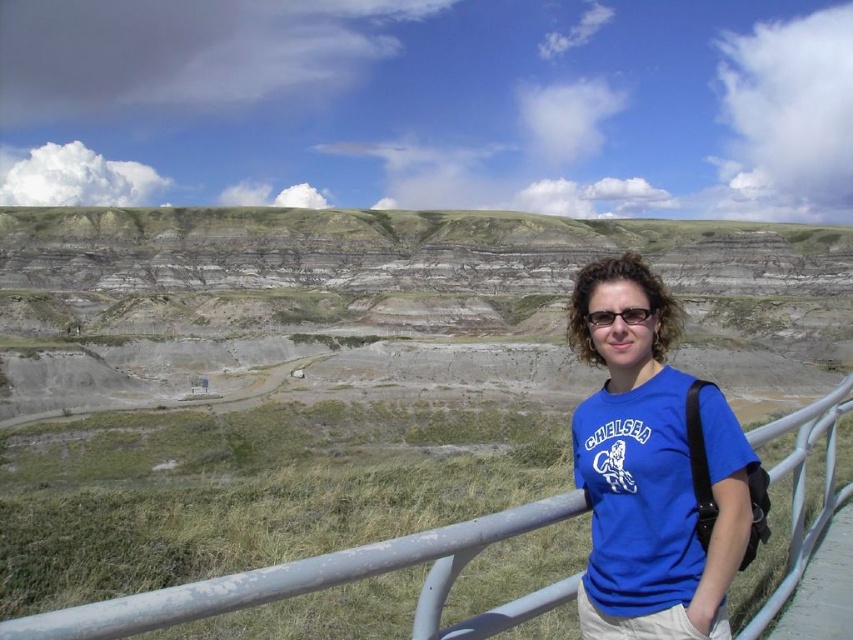
Question: Which point appears farthest from the camera in this image?

Choices:
 (A) (648, 317)
 (B) (612, 500)
 (C) (741, 634)

Answer: (A)

Question: Which point is closer to the camera?

Choices:
 (A) blue cotton shirt at center
 (B) white matte rail at center
 (C) black plastic glasses at center

Answer: (B)

Question: Is blue cotton shirt at center positioned before white matte rail at center?

Choices:
 (A) no
 (B) yes

Answer: (A)

Question: In this image, where is blue cotton shirt at center located relative to white matte rail at center?

Choices:
 (A) below
 (B) above

Answer: (B)

Question: Observing the image, what is the correct spatial positioning of blue cotton shirt at center in reference to white matte rail at center?

Choices:
 (A) above
 (B) below

Answer: (A)

Question: Which of the following is the farthest from the observer?

Choices:
 (A) blue cotton shirt at center
 (B) white matte rail at center
 (C) black plastic glasses at center

Answer: (C)